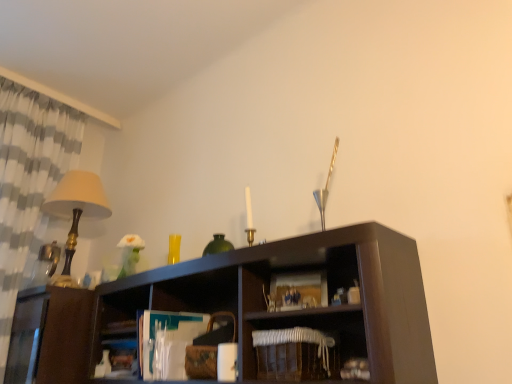
Question: Would you say white checkered fabric at left is a long distance from white woven basket at lower center?

Choices:
 (A) no
 (B) yes

Answer: (B)

Question: Are white checkered fabric at left and white woven basket at lower center making contact?

Choices:
 (A) no
 (B) yes

Answer: (A)

Question: Is white checkered fabric at left facing towards white woven basket at lower center?

Choices:
 (A) no
 (B) yes

Answer: (B)

Question: Is white checkered fabric at left surrounding white woven basket at lower center?

Choices:
 (A) yes
 (B) no

Answer: (B)

Question: Is white checkered fabric at left positioned with its back to white woven basket at lower center?

Choices:
 (A) yes
 (B) no

Answer: (B)

Question: Does white checkered fabric at left come behind white woven basket at lower center?

Choices:
 (A) no
 (B) yes

Answer: (B)

Question: From a real-world perspective, does white woven basket at lower center sit lower than white checkered fabric at left?

Choices:
 (A) no
 (B) yes

Answer: (B)

Question: Can you confirm if white woven basket at lower center is wider than white checkered fabric at left?

Choices:
 (A) no
 (B) yes

Answer: (A)

Question: From a real-world perspective, is white woven basket at lower center on top of white checkered fabric at left?

Choices:
 (A) no
 (B) yes

Answer: (A)

Question: Can you confirm if white woven basket at lower center is positioned to the right of white checkered fabric at left?

Choices:
 (A) yes
 (B) no

Answer: (A)

Question: Can you confirm if white woven basket at lower center is taller than white checkered fabric at left?

Choices:
 (A) no
 (B) yes

Answer: (A)

Question: Can you confirm if white woven basket at lower center is positioned to the left of white checkered fabric at left?

Choices:
 (A) no
 (B) yes

Answer: (A)

Question: Are white woven basket at lower center and matte gold table lamp at left making contact?

Choices:
 (A) yes
 (B) no

Answer: (B)